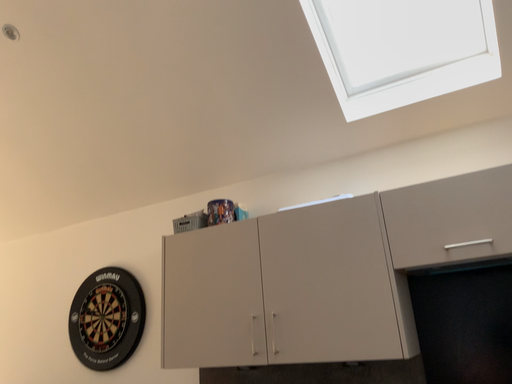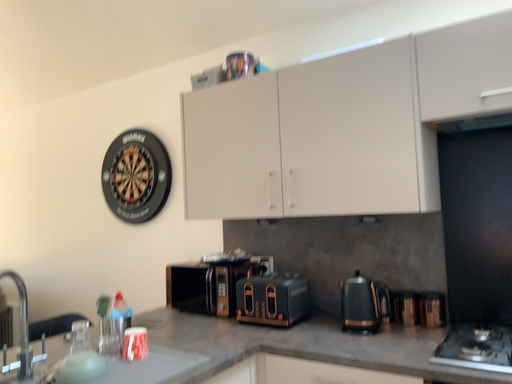
Question: Which way did the camera rotate in the video?

Choices:
 (A) rotated downward
 (B) rotated upward

Answer: (A)